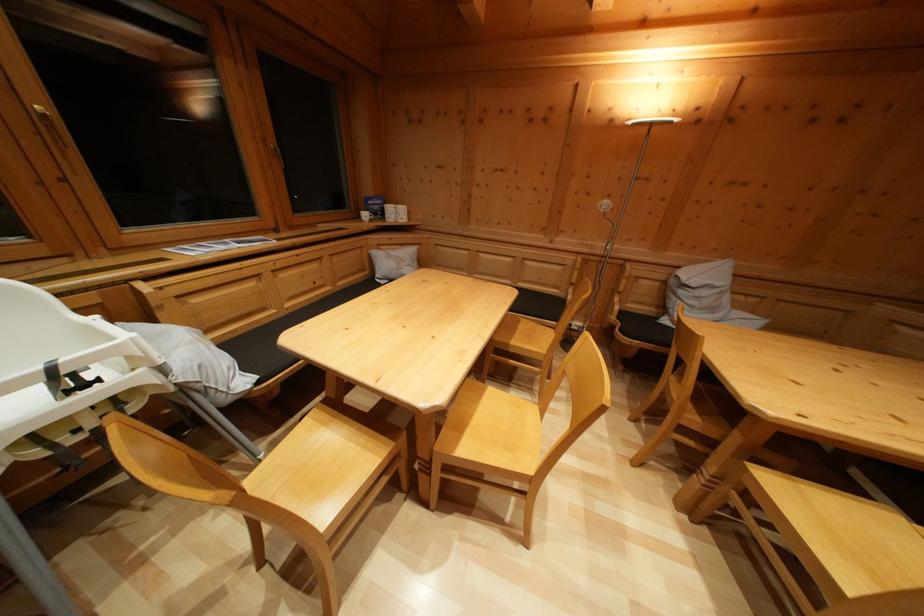
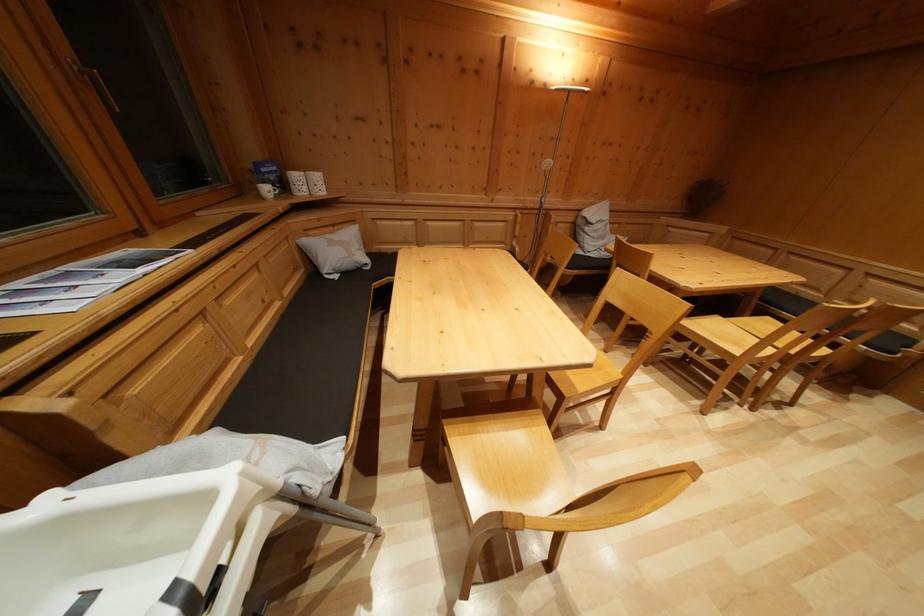
Locate, in the second image, the point that corresponds to point (371, 222) in the first image.

(273, 197)